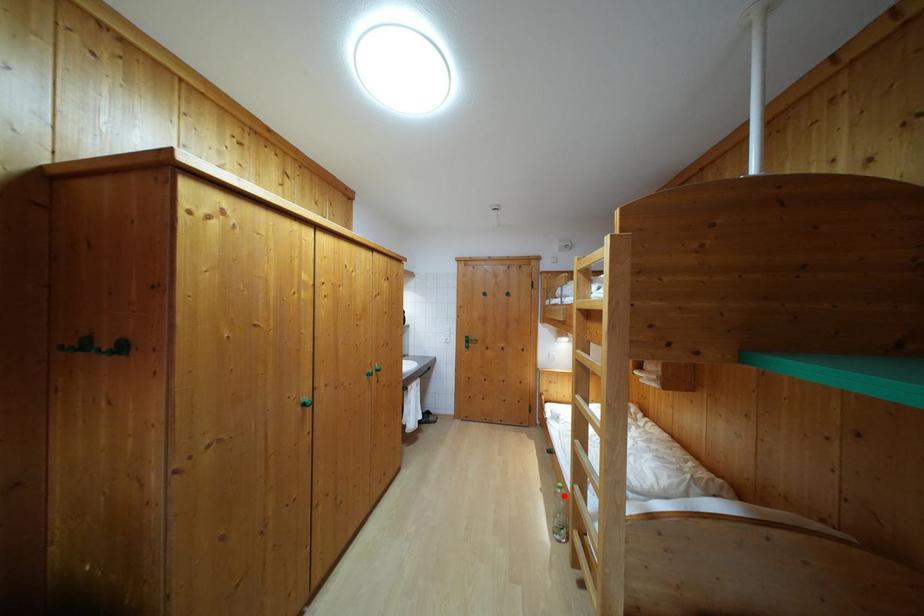
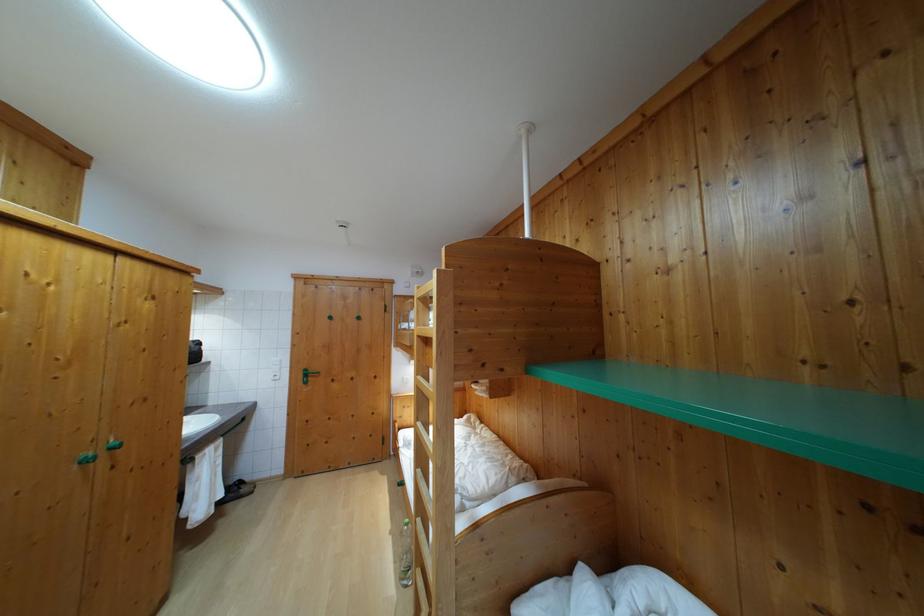
Question: I am providing you with two images of the same scene from different viewpoints. A red point is marked on the first image. Can you still see the location of the red point in image 2?

Choices:
 (A) Yes
 (B) No

Answer: (A)